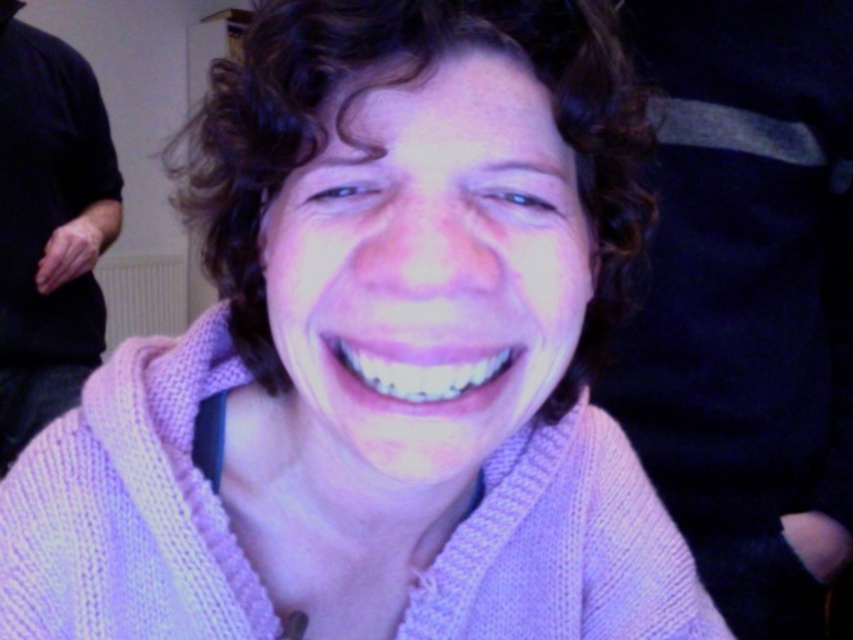
You are a photographer trying to adjust the lighting for a portrait. You notice a point at coordinates point (381, 152) in the image. What object is located at that point?

The point (381, 152) is where the curly brown hair at center is located.

Based on the scene description, which object is wider, the curly brown hair at center or the pink knitted sweater at left?

The curly brown hair at center is wider than the pink knitted sweater at left according to the description.

Consider the image. You are a photographer trying to adjust the lighting for a portrait. You notice the curly brown hair at center and the pink knitted sweater at left in your frame. Which object should you focus the light on to ensure proper exposure, considering their sizes in the image?

The curly brown hair at center has a lesser height compared to the pink knitted sweater at left, so you should focus the light on the pink knitted sweater at left since it is larger and requires more even lighting for proper exposure.